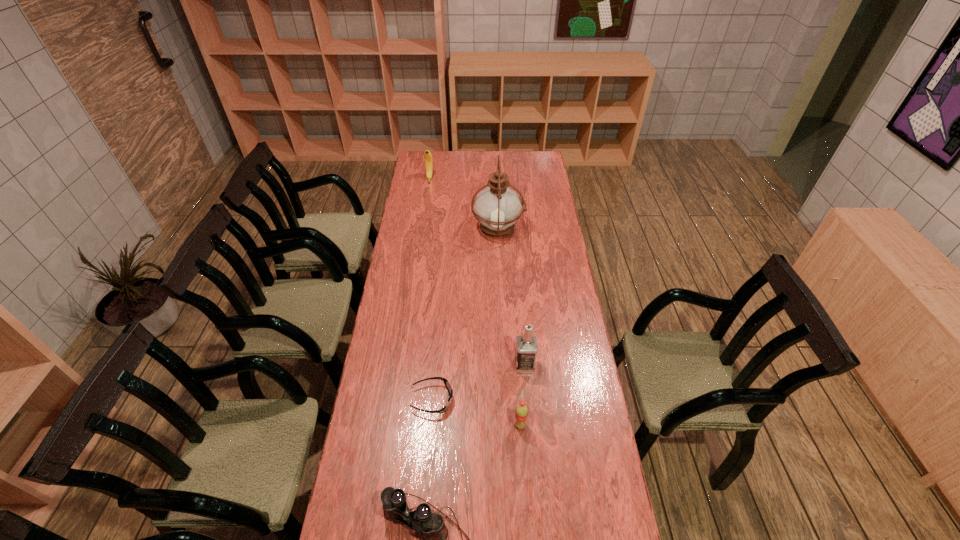
This screenshot has width=960, height=540. What are the coordinates of `free space at the right edge of the desktop` in the screenshot? It's located at (542, 240).

I want to click on vacant space at the far right corner of the desktop, so click(534, 154).

The height and width of the screenshot is (540, 960). Identify the location of free space between the second nearest object and the oil lamp. (509, 327).

The image size is (960, 540). Find the location of `vacant area between the farthest object and the tallest object`. vacant area between the farthest object and the tallest object is located at coordinates (464, 204).

This screenshot has width=960, height=540. Identify the location of free space between the farthest object and the third farthest object. (477, 272).

Where is `vacant area between the tallest object and the fifth shortest object`? The width and height of the screenshot is (960, 540). vacant area between the tallest object and the fifth shortest object is located at coordinates (512, 296).

This screenshot has height=540, width=960. What are the coordinates of `vacant area between the oil lamp and the third nearest object` in the screenshot? It's located at (466, 314).

Where is `vacant region between the third nearest object and the second nearest object`? vacant region between the third nearest object and the second nearest object is located at coordinates (476, 412).

The width and height of the screenshot is (960, 540). Identify the location of free spot between the second tallest object and the shortest object. (478, 382).

Find the location of a particular element. free area in between the tallest object and the soda is located at coordinates (509, 327).